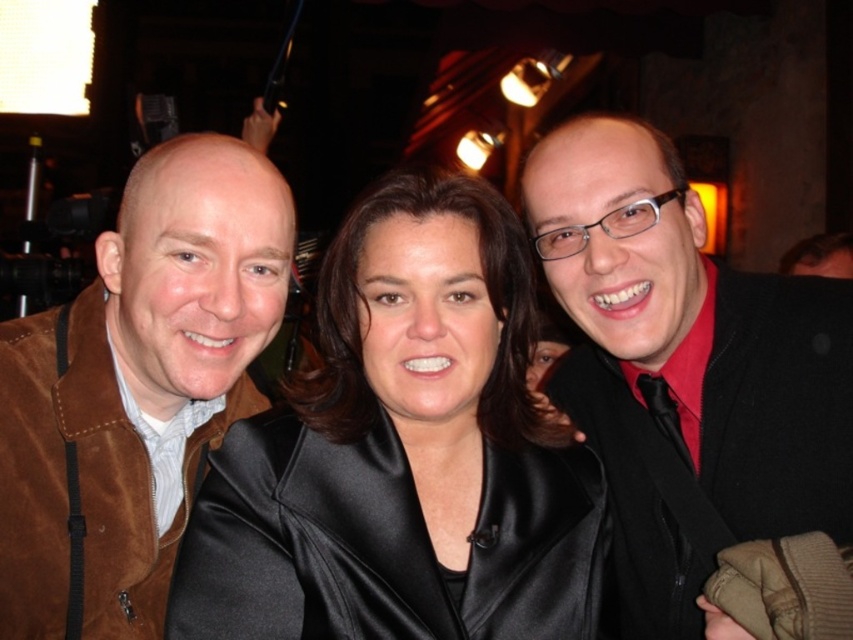
Question: Which object is closer to the camera taking this photo?

Choices:
 (A) suede jacket at left
 (B) satin black jacket at center
 (C) black matte jacket at center

Answer: (B)

Question: Does black matte jacket at center have a smaller size compared to suede jacket at left?

Choices:
 (A) yes
 (B) no

Answer: (B)

Question: Which object appears farthest from the camera in this image?

Choices:
 (A) satin black jacket at center
 (B) suede jacket at left

Answer: (B)

Question: Does black matte jacket at center lie in front of suede jacket at left?

Choices:
 (A) yes
 (B) no

Answer: (A)

Question: Among these objects, which one is farthest from the camera?

Choices:
 (A) suede jacket at left
 (B) satin black jacket at center

Answer: (A)

Question: Is satin black jacket at center smaller than black matte jacket at center?

Choices:
 (A) yes
 (B) no

Answer: (A)